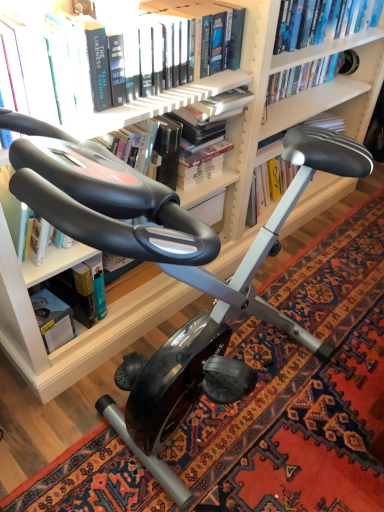
This screenshot has height=512, width=384. Describe the element at coordinates (154, 104) in the screenshot. I see `hardcover book at upper center, acting as the fourth book starting from the back` at that location.

Measure the distance between hardcover book at upper center, the 1th book from the back, and camera.

They are 1.59 meters apart.

The width and height of the screenshot is (384, 512). What do you see at coordinates (325, 122) in the screenshot? I see `hardcover book at upper center, the 1th book from the back` at bounding box center [325, 122].

Where is `hardcover book at left, the 2th book positioned from the back`? This screenshot has height=512, width=384. hardcover book at left, the 2th book positioned from the back is located at coordinates (78, 288).

Can you confirm if hardcover book at center, the 3th book positioned from the back, is bigger than black rubber exercise bike at center?

Incorrect, hardcover book at center, the 3th book positioned from the back, is not larger than black rubber exercise bike at center.

From the image's perspective, is hardcover book at center, the 3th book positioned from the back, located above or below black rubber exercise bike at center?

hardcover book at center, the 3th book positioned from the back, is situated higher than black rubber exercise bike at center in the image.

In the image, is hardcover book at center, the 3th book positioned from the back, positioned in front of or behind black rubber exercise bike at center?

hardcover book at center, the 3th book positioned from the back, is behind black rubber exercise bike at center.

Is point (77, 302) positioned before point (243, 86)?

No, it is behind (243, 86).

From a real-world perspective, who is located lower, hardcover book at left, the 2th book positioned from the back, or hardcover book at center, positioned as the 2th book in front-to-back order?

From a 3D spatial view, hardcover book at left, the 2th book positioned from the back, is below.

Based on the photo, can you confirm if hardcover book at left, which is counted as the third book, starting from the front, is bigger than hardcover book at center, the 3th book positioned from the back?

No, hardcover book at left, which is counted as the third book, starting from the front, is not bigger than hardcover book at center, the 3th book positioned from the back.

Could you measure the distance between hardcover book at left, the 2th book positioned from the back, and hardcover book at center, the 3th book positioned from the back?

19.59 inches.

Is the surface of hardcover book at upper center, the 1th book from the front, in direct contact with hardcover book at center, the 3th book positioned from the back?

Yes, hardcover book at upper center, the 1th book from the front, is touching hardcover book at center, the 3th book positioned from the back.

Between hardcover book at upper center, acting as the fourth book starting from the back, and hardcover book at center, the 3th book positioned from the back, which one has less height?

Standing shorter between the two is hardcover book at upper center, acting as the fourth book starting from the back.

I want to click on the 1st book counting from the right side of the hardcover book at upper center, acting as the fourth book starting from the back, so click(x=212, y=115).

Is point (208, 99) closer to viewer compared to point (35, 313)?

Yes, it is in front of point (35, 313).

Would you consider hardcover book at center, positioned as the 2th book in front-to-back order, to be distant from hardcover book at lower left?

They are positioned close to each other.

Is hardcover book at center, positioned as the 2th book in front-to-back order, behind hardcover book at lower left?

That is False.

Is black rubber exercise bike at center aimed at hardcover book at upper center, the 1th book from the back?

No, black rubber exercise bike at center is not turned towards hardcover book at upper center, the 1th book from the back.

Can you confirm if black rubber exercise bike at center is taller than hardcover book at upper center, which appears as the 4th book when viewed from the front?

In fact, black rubber exercise bike at center may be shorter than hardcover book at upper center, which appears as the 4th book when viewed from the front.

Is point (364, 214) behind point (280, 139)?

That is True.

Between hardcover book at upper center, the 1th book from the back, and hardcover book at upper center, the 1th book from the front, which one has smaller size?

With smaller size is hardcover book at upper center, the 1th book from the back.

Would you consider hardcover book at upper center, the 1th book from the back, to be distant from hardcover book at upper center, the 1th book from the front?

No, there isn't a large distance between hardcover book at upper center, the 1th book from the back, and hardcover book at upper center, the 1th book from the front.

From a real-world perspective, is hardcover book at upper center, the 1th book from the back, positioned above or below hardcover book at upper center, acting as the fourth book starting from the back?

From a real-world perspective, hardcover book at upper center, the 1th book from the back, is physically below hardcover book at upper center, acting as the fourth book starting from the back.

Considering the positions of objects hardcover book at center, the 3th book positioned from the back, and hardcover book at upper center, which appears as the 4th book when viewed from the front, in the image provided, who is behind, hardcover book at center, the 3th book positioned from the back, or hardcover book at upper center, which appears as the 4th book when viewed from the front,?

hardcover book at upper center, which appears as the 4th book when viewed from the front, is further away from the camera.

Is hardcover book at upper center, the 1th book from the back, surrounded by hardcover book at center, the 3th book positioned from the back?

That's incorrect, hardcover book at upper center, the 1th book from the back, is not inside hardcover book at center, the 3th book positioned from the back.

Are hardcover book at center, the 3th book positioned from the back, and hardcover book at upper center, which appears as the 4th book when viewed from the front, making contact?

There is a gap between hardcover book at center, the 3th book positioned from the back, and hardcover book at upper center, which appears as the 4th book when viewed from the front.

From their relative heights in the image, would you say hardcover book at center, positioned as the 2th book in front-to-back order, is taller or shorter than hardcover book at upper center, the 1th book from the back?

In the image, hardcover book at center, positioned as the 2th book in front-to-back order, appears to be taller than hardcover book at upper center, the 1th book from the back.

This screenshot has width=384, height=512. In the image, there is a hardcover book at center, the 3th book positioned from the back. In order to click on mat below it (from a real-world perspective) in this screenshot , I will do click(303, 388).

Find the location of `the 2nd book to the right when counting from the hardcover book at left, which is counted as the third book, starting from the front`. the 2nd book to the right when counting from the hardcover book at left, which is counted as the third book, starting from the front is located at coordinates (212, 115).

Looking at the image, which one is located further to black rubber exercise bike at center, hardcover book at center, positioned as the 2th book in front-to-back order, or hardcover book at left, which is counted as the third book, starting from the front?

hardcover book at center, positioned as the 2th book in front-to-back order.

When comparing their distances from black rubber exercise bike at center, does hardcover book at upper center, the 1th book from the back, or hardcover book at left, which is counted as the third book, starting from the front, seem closer?

Among the two, hardcover book at left, which is counted as the third book, starting from the front, is located nearer to black rubber exercise bike at center.

Estimate the real-world distances between objects in this image. Which object is further from hardcover book at upper center, acting as the fourth book starting from the back, hardcover book at upper center, the 1th book from the back, or hardcover book at left, the 2th book positioned from the back?

Among the two, hardcover book at upper center, the 1th book from the back, is located further to hardcover book at upper center, acting as the fourth book starting from the back.

Estimate the real-world distances between objects in this image. Which object is further from hardcover book at center, positioned as the 2th book in front-to-back order, black rubber exercise bike at center or hardcover book at upper center, the 1th book from the front?

Among the two, black rubber exercise bike at center is located further to hardcover book at center, positioned as the 2th book in front-to-back order.

Considering their positions, is black rubber exercise bike at center positioned closer to hardcover book at left, the 2th book positioned from the back, than hardcover book at upper center, which appears as the 4th book when viewed from the front?

black rubber exercise bike at center.

From the picture: Estimate the real-world distances between objects in this image. Which object is further from black rubber exercise bike at center, hardcover book at lower left or hardcover book at upper center, which appears as the 4th book when viewed from the front?

The object further to black rubber exercise bike at center is hardcover book at upper center, which appears as the 4th book when viewed from the front.

When comparing their distances from black rubber exercise bike at center, does hardcover book at upper center, acting as the fourth book starting from the back, or hardcover book at lower left seem further?

hardcover book at upper center, acting as the fourth book starting from the back, is positioned further to the anchor black rubber exercise bike at center.

Estimate the real-world distances between objects in this image. Which object is further from hardcover book at center, positioned as the 2th book in front-to-back order, black rubber exercise bike at center or hardcover book at left, which is counted as the third book, starting from the front?

black rubber exercise bike at center is positioned further to the anchor hardcover book at center, positioned as the 2th book in front-to-back order.

This screenshot has height=512, width=384. In order to click on mat located between hardcover book at lower left and hardcover book at upper center, which appears as the 4th book when viewed from the front, in the left-right direction in this screenshot , I will do `click(303, 388)`.

I want to click on paperback book between hardcover book at upper center, acting as the fourth book starting from the back, and hardcover book at upper center, which appears as the 4th book when viewed from the front, in the front-back direction, so click(53, 319).

Identify the location of book between hardcover book at upper center, acting as the fourth book starting from the back, and hardcover book at left, which is counted as the third book, starting from the front, from top to bottom. Image resolution: width=384 pixels, height=512 pixels. (212, 115).

Find the location of a particular element. The image size is (384, 512). book between hardcover book at center, the 3th book positioned from the back, and hardcover book at lower left in the up-down direction is located at coordinates (78, 288).